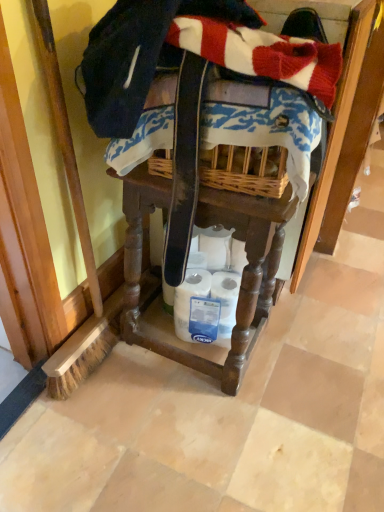
The height and width of the screenshot is (512, 384). What do you see at coordinates (208, 290) in the screenshot?
I see `white matte toilet paper at lower center` at bounding box center [208, 290].

Where is `white matte toilet paper at lower center`? This screenshot has height=512, width=384. white matte toilet paper at lower center is located at coordinates (208, 290).

Is wooden vanity at center far away from blue printed fabric at center?

No, there isn't a large distance between wooden vanity at center and blue printed fabric at center.

Between wooden vanity at center and blue printed fabric at center, which one appears on the left side from the viewer's perspective?

wooden vanity at center.

Considering the positions of points (125, 290) and (302, 172), is point (125, 290) farther from camera compared to point (302, 172)?

Yes, it is.

In the scene shown: Between white matte toilet paper at lower center and wooden vanity at center, which one has more height?

wooden vanity at center is taller.

From the picture: Is white matte toilet paper at lower center surrounding wooden vanity at center?

No, wooden vanity at center is not a part of white matte toilet paper at lower center.

Would you consider white matte toilet paper at lower center to be distant from wooden vanity at center?

white matte toilet paper at lower center is near wooden vanity at center, not far away.

Relative to wooden vanity at center, is white matte toilet paper at lower center in front or behind?

Visually, white matte toilet paper at lower center is located behind wooden vanity at center.

Is wooden vanity at center to the left of white matte toilet paper at lower center from the viewer's perspective?

Correct, you'll find wooden vanity at center to the left of white matte toilet paper at lower center.

Which object is thinner, wooden vanity at center or white matte toilet paper at lower center?

Thinner between the two is white matte toilet paper at lower center.

Does wooden vanity at center touch white matte toilet paper at lower center?

They are not placed beside each other.

Considering the relative sizes of blue printed fabric at center and wooden vanity at center in the image provided, is blue printed fabric at center smaller than wooden vanity at center?

Correct, blue printed fabric at center occupies less space than wooden vanity at center.

From a real-world perspective, is blue printed fabric at center positioned above or below wooden vanity at center?

From a real-world perspective, blue printed fabric at center is physically above wooden vanity at center.

Is blue printed fabric at center taller or shorter than wooden vanity at center?

Clearly, blue printed fabric at center is shorter compared to wooden vanity at center.

Considering the sizes of objects blue printed fabric at center and wooden vanity at center in the image provided, who is thinner, blue printed fabric at center or wooden vanity at center?

With smaller width is blue printed fabric at center.

What's the angular difference between blue printed fabric at center and white matte toilet paper at lower center's facing directions?

69.9 degrees separate the facing orientations of blue printed fabric at center and white matte toilet paper at lower center.

Find the location of a particular element. This screenshot has height=512, width=384. underclothes above the white matte toilet paper at lower center (from the image's perspective) is located at coordinates 268,131.

Which is less distant, (310, 152) or (234, 279)?

Clearly, point (310, 152) is closer to the camera than point (234, 279).

Between blue printed fabric at center and white matte toilet paper at lower center, which one has smaller size?

Smaller between the two is white matte toilet paper at lower center.

Is white matte toilet paper at lower center looking in the opposite direction of blue printed fabric at center?

No.

Which is in front, point (224, 346) or point (136, 140)?

Positioned in front is point (136, 140).

Considering the relative positions of white matte toilet paper at lower center and blue printed fabric at center in the image provided, is white matte toilet paper at lower center behind blue printed fabric at center?

Yes, it is behind blue printed fabric at center.

Can you confirm if white matte toilet paper at lower center is thinner than blue printed fabric at center?

Yes.

Where is `vanity that appears behind the blue printed fabric at center`? This screenshot has width=384, height=512. vanity that appears behind the blue printed fabric at center is located at coordinates (241, 280).

The image size is (384, 512). What are the coordinates of `toilet paper on the right of wooden vanity at center` in the screenshot? It's located at (208, 290).

Looking at the image, which one is located closer to white matte toilet paper at lower center, wooden vanity at center or blue printed fabric at center?

Based on the image, wooden vanity at center appears to be nearer to white matte toilet paper at lower center.

Considering their positions, is wooden vanity at center positioned closer to blue printed fabric at center than white matte toilet paper at lower center?

wooden vanity at center.

Considering their positions, is blue printed fabric at center positioned closer to wooden vanity at center than white matte toilet paper at lower center?

white matte toilet paper at lower center.

Estimate the real-world distances between objects in this image. Which object is closer to wooden vanity at center, white matte toilet paper at lower center or blue printed fabric at center?

white matte toilet paper at lower center.

Looking at this image, looking at the image, which one is located closer to blue printed fabric at center, white matte toilet paper at lower center or wooden vanity at center?

wooden vanity at center is closer to blue printed fabric at center.

Looking at the image, which one is located closer to white matte toilet paper at lower center, blue printed fabric at center or wooden vanity at center?

wooden vanity at center.

Find the location of `vanity between blue printed fabric at center and white matte toilet paper at lower center in the up-down direction`. vanity between blue printed fabric at center and white matte toilet paper at lower center in the up-down direction is located at coordinates (241, 280).